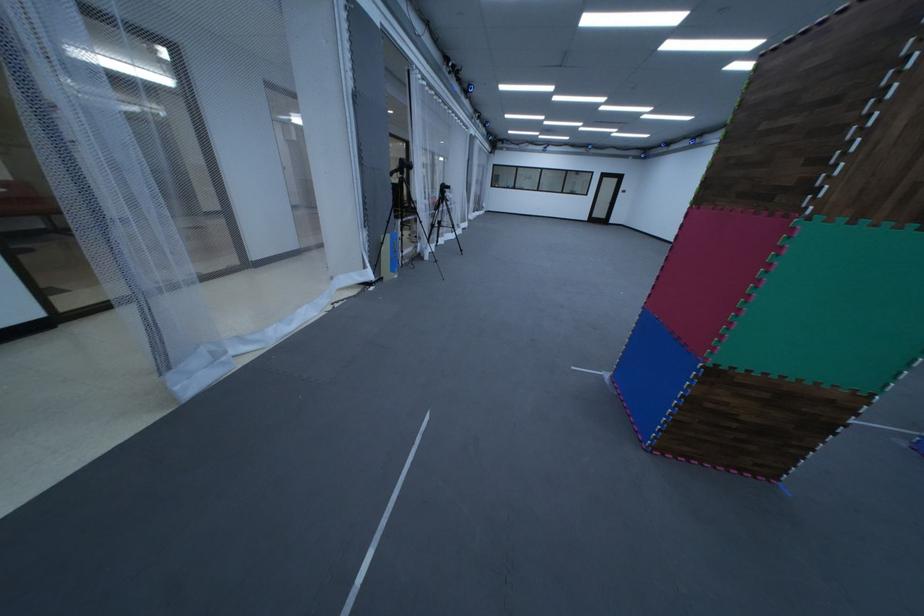
Where would you pull the black door handle? Please return your answer as a coordinate pair (x, y).

(618, 213)